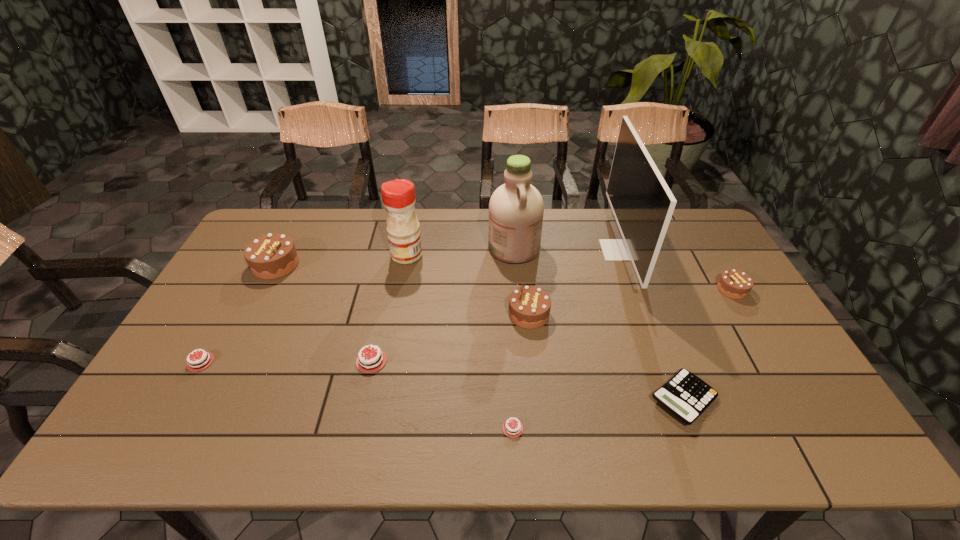
The height and width of the screenshot is (540, 960). I want to click on black monitor, so click(642, 203).

Find the location of a particular element. This screenshot has height=540, width=960. cleansing agent is located at coordinates (516, 208).

Identify the location of the eighth shortest object. pos(403,228).

Identify the location of red condiment. (403, 228).

This screenshot has height=540, width=960. What are the coordinates of `the seventh shortest object` in the screenshot? It's located at (271, 256).

The height and width of the screenshot is (540, 960). In order to click on the biggest brown chocolate cake in this screenshot , I will do `click(271, 256)`.

The height and width of the screenshot is (540, 960). What are the coordinates of `the second brown chocolate cake from left to right` in the screenshot? It's located at (529, 306).

Identify the location of the fifth tallest object. The width and height of the screenshot is (960, 540). (529, 306).

The height and width of the screenshot is (540, 960). I want to click on the rightmost chocolate cake, so click(734, 284).

What are the coordinates of `the rightmost brown chocolate cake` in the screenshot? It's located at (734, 284).